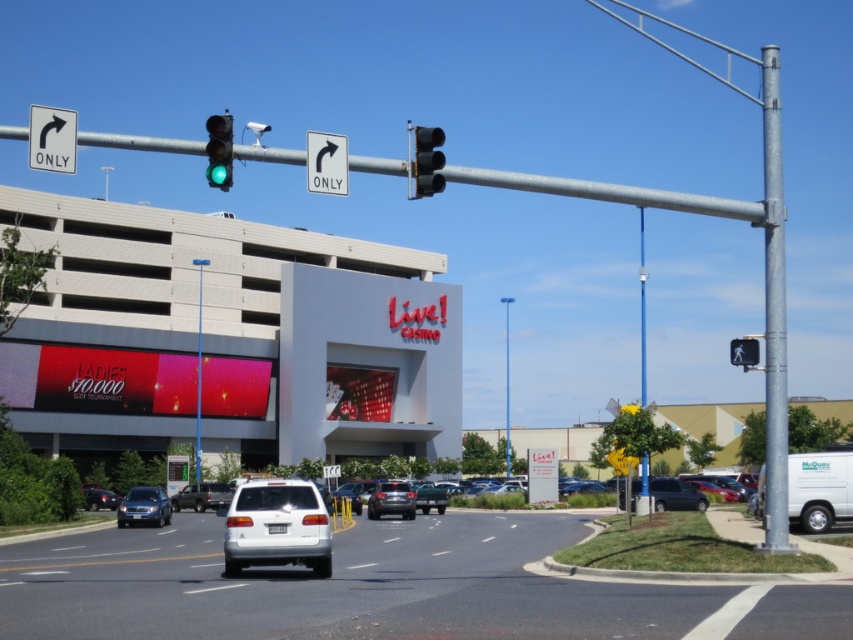
Does white smooth building at center appear over blue metallic pole at upper right?

No.

Is white smooth building at center to the right of blue metallic pole at upper right from the viewer's perspective?

No, white smooth building at center is not to the right of blue metallic pole at upper right.

Does point (42, 412) come in front of point (639, 250)?

Yes, point (42, 412) is closer to viewer.

You are a GUI agent. You are given a task and a screenshot of the screen. Output one action in this format:
    pyautogui.click(x=<x>, y=<y>)
    Task: Click on the white smooth building at center
    The width and height of the screenshot is (853, 640).
    Given the screenshot: What is the action you would take?
    pyautogui.click(x=228, y=337)

Which is behind, point (213, 125) or point (410, 516)?

The point (410, 516) is more distant.

Is point (209, 170) behind point (386, 490)?

No, (209, 170) is closer to viewer.

I want to click on green glass traffic light at upper center, so click(219, 150).

Is white smooth building at center positioned in front of silver metallic sedan at center?

No, it is not.

Between white smooth building at center and silver metallic sedan at center, which one is positioned higher?

white smooth building at center is above.

Which is behind, point (189, 349) or point (408, 513)?

The point (189, 349) is more distant.

Where is `white smooth building at center`? white smooth building at center is located at coordinates (228, 337).